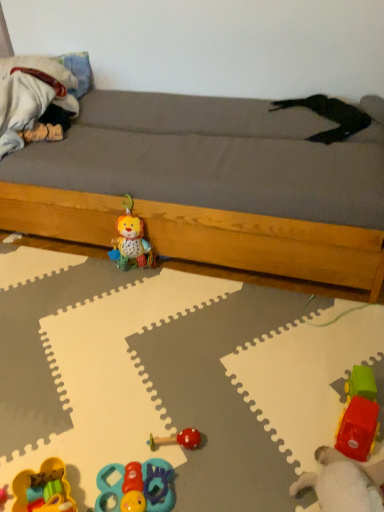
You are a GUI agent. You are given a task and a screenshot of the screen. Output one action in this format:
    pyautogui.click(x=<x>, y=<y>)
    Task: Click on the vacant space that's between plush fabric lion at center, the 2th toy when ordered from left to right, and rubberized plastic car at lower right, the fifth toy when ordered from left to right
    The width and height of the screenshot is (384, 512).
    Given the screenshot: What is the action you would take?
    pyautogui.click(x=214, y=361)